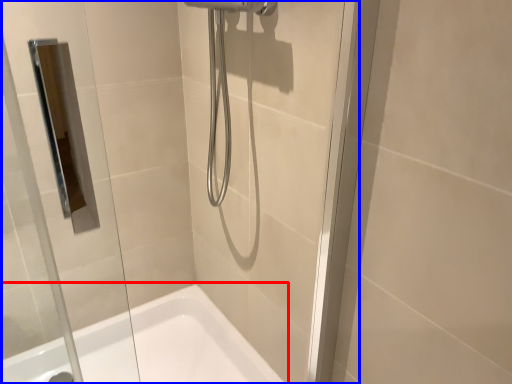
Question: Which object is further to the camera taking this photo, bathtub (highlighted by a red box) or glass door (highlighted by a blue box)?

Choices:
 (A) bathtub
 (B) glass door

Answer: (A)